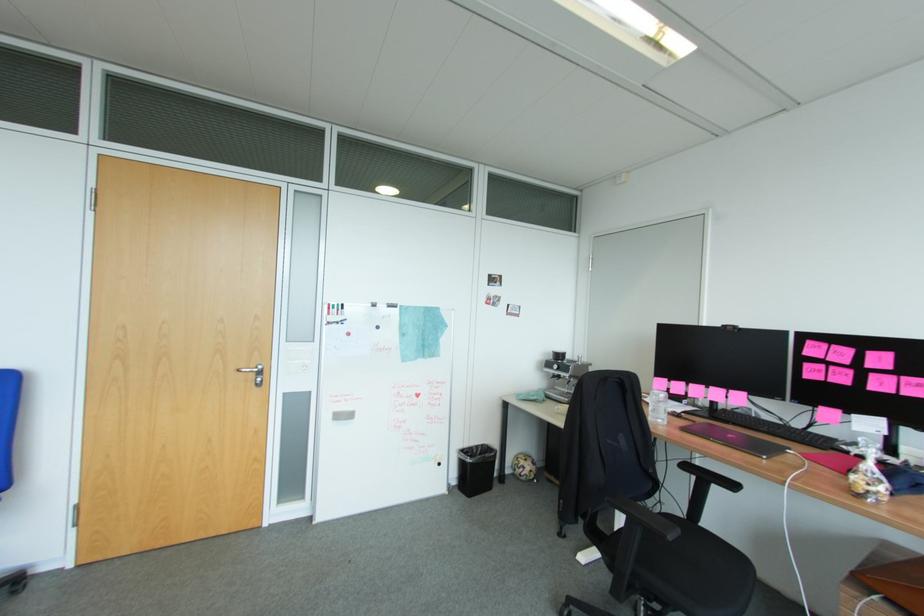
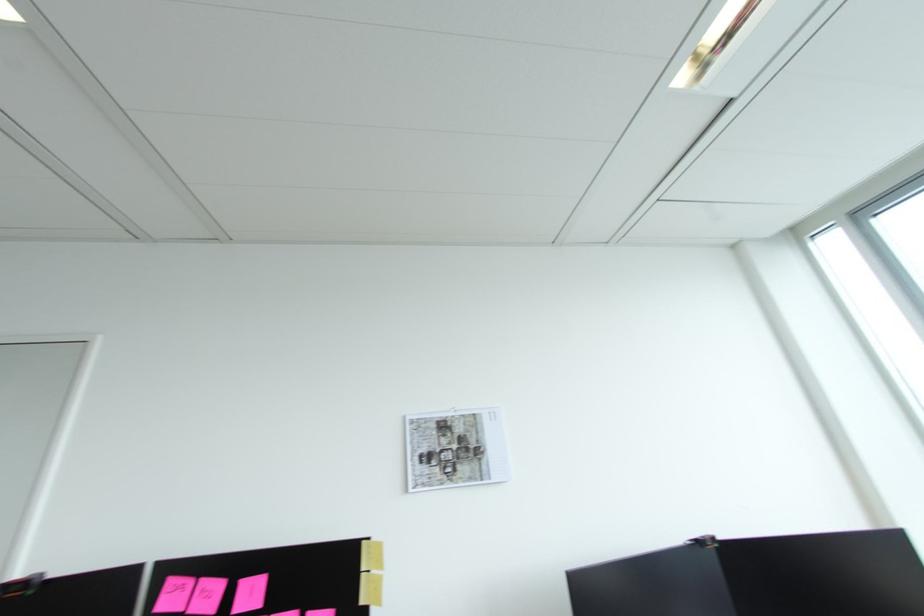
Where in the second image is the point corresponding to the point at 846,354 from the first image?

(213, 594)